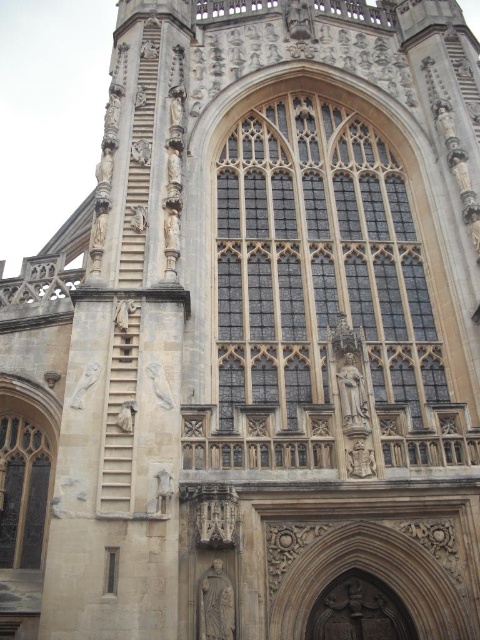
Question: Is the position of stained glass window at center less distant than that of dark glass window at lower left?

Choices:
 (A) no
 (B) yes

Answer: (B)

Question: Among these points, which one is nearest to the camera?

Choices:
 (A) (239, 202)
 (B) (11, 541)

Answer: (B)

Question: Is stained glass window at center behind dark glass window at lower left?

Choices:
 (A) yes
 (B) no

Answer: (B)

Question: Observing the image, what is the correct spatial positioning of stained glass window at center in reference to dark glass window at lower left?

Choices:
 (A) below
 (B) above

Answer: (B)